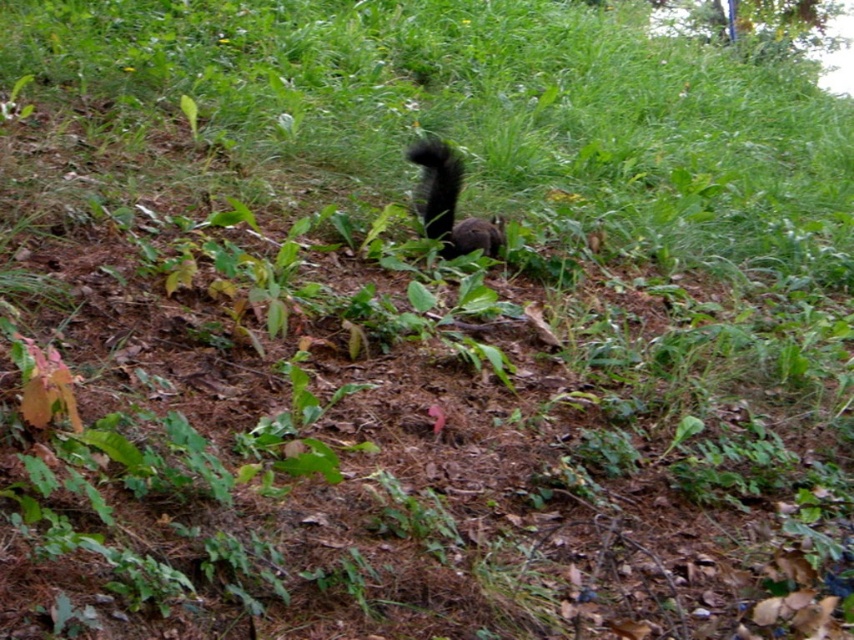
Image resolution: width=854 pixels, height=640 pixels. What do you see at coordinates (449, 204) in the screenshot? I see `black furry squirrel at center` at bounding box center [449, 204].

Between point (419, 144) and point (449, 248), which one is positioned in front?

Point (449, 248) is more forward.

Image resolution: width=854 pixels, height=640 pixels. Identify the location of black furry squirrel at center. (449, 204).

What are the coordinates of `black furry squirrel at center` in the screenshot? It's located at (449, 204).